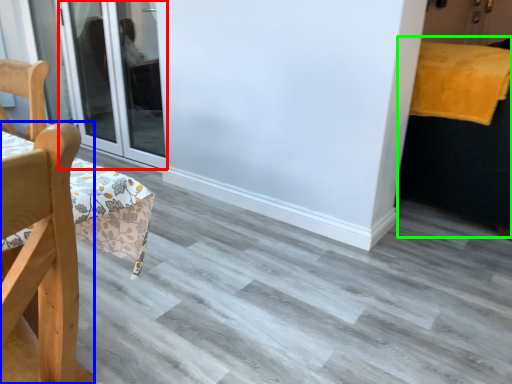
Question: Considering the real-world distances, which object is farthest from door (highlighted by a red box)? chair (highlighted by a blue box) or bed (highlighted by a green box)?

Choices:
 (A) chair
 (B) bed

Answer: (A)